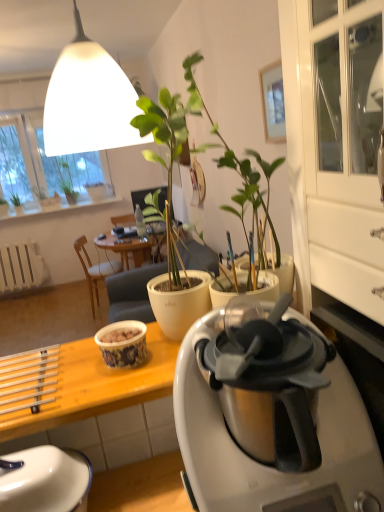
Question: From the image's perspective, is white ceramic window sill at upper left located above or below white matte flowerpot at upper center?

Choices:
 (A) above
 (B) below

Answer: (B)

Question: In terms of width, does white ceramic window sill at upper left look wider or thinner when compared to white matte flowerpot at upper center?

Choices:
 (A) thin
 (B) wide

Answer: (A)

Question: Based on their relative distances, which object is nearer to the yellow wood desk at lower left?

Choices:
 (A) green matte plant at upper left, the third houseplant from the left
 (B) white matte radiator at lower left
 (C) matte ceramic cup at center
 (D) wooden chair at center
 (E) white glossy kettle at lower left

Answer: (C)

Question: Considering the real-world distances, which object is farthest from the white ceramic window sill at upper left?

Choices:
 (A) silver metallic coffee maker at center
 (B) green matte plant at upper left, the 2th houseplant from the right
 (C) white matte lampshade at upper center
 (D) transparent plastic window screen at upper left
 (E) green matte plant at upper left, marked as the 1th houseplant in a right-to-left arrangement

Answer: (A)